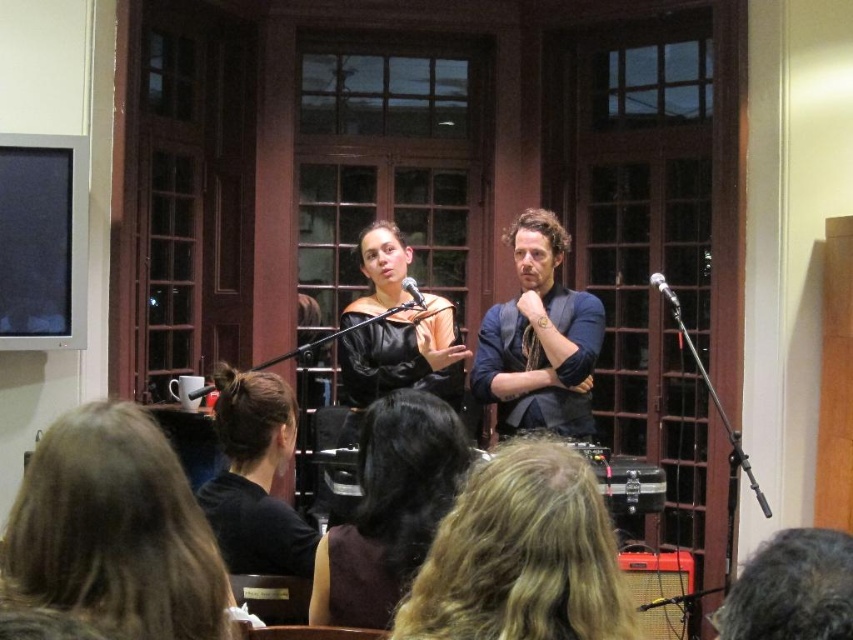
Question: Which point is closer to the camera?

Choices:
 (A) black leather hair at center
 (B) dark brown hair at lower right
 (C) metallic silver microphone at center
 (D) blue fabric shirt at center

Answer: (B)

Question: Is blue fabric shirt at center positioned in front of metallic silver microphone at center?

Choices:
 (A) yes
 (B) no

Answer: (B)

Question: Does dark brown leather jacket at center have a smaller size compared to blue fabric shirt at center?

Choices:
 (A) yes
 (B) no

Answer: (A)

Question: Which object is closer to the camera taking this photo?

Choices:
 (A) black leather jacket at center
 (B) blue fabric shirt at center
 (C) metallic silver microphone at center

Answer: (C)

Question: Is blue fabric shirt at center to the right of orange amplifier at lower right from the viewer's perspective?

Choices:
 (A) yes
 (B) no

Answer: (B)

Question: Which object appears closest to the camera in this image?

Choices:
 (A) dark brown hair at lower right
 (B) blonde hair at lower left
 (C) metallic silver microphone at center

Answer: (B)